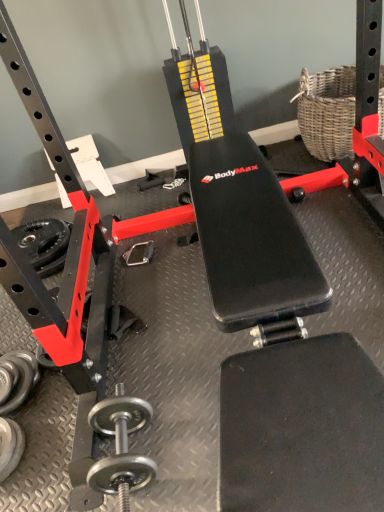
Question: Is silver metallic dumbbell at lower left, which is the third dumbbell in right-to-left order, next to woven wicker basket at upper right?

Choices:
 (A) yes
 (B) no

Answer: (B)

Question: Can you confirm if silver metallic dumbbell at lower left, marked as the first dumbbell in a left-to-right arrangement, is thinner than woven wicker basket at upper right?

Choices:
 (A) yes
 (B) no

Answer: (A)

Question: Can you confirm if silver metallic dumbbell at lower left, which is the third dumbbell in right-to-left order, is taller than woven wicker basket at upper right?

Choices:
 (A) yes
 (B) no

Answer: (B)

Question: Is silver metallic dumbbell at lower left, which is the third dumbbell in right-to-left order, far away from woven wicker basket at upper right?

Choices:
 (A) yes
 (B) no

Answer: (A)

Question: Can you confirm if silver metallic dumbbell at lower left, which is the third dumbbell in right-to-left order, is bigger than woven wicker basket at upper right?

Choices:
 (A) no
 (B) yes

Answer: (A)

Question: Could you tell me if silver metallic dumbbell at lower left, marked as the first dumbbell in a left-to-right arrangement, is facing woven wicker basket at upper right?

Choices:
 (A) no
 (B) yes

Answer: (A)

Question: Is woven wicker basket at upper right touching rubberized black weight at lower left?

Choices:
 (A) yes
 (B) no

Answer: (B)

Question: Considering the relative sizes of woven wicker basket at upper right and rubberized black weight at lower left in the image provided, is woven wicker basket at upper right smaller than rubberized black weight at lower left?

Choices:
 (A) no
 (B) yes

Answer: (A)

Question: Considering the relative sizes of woven wicker basket at upper right and rubberized black weight at lower left in the image provided, is woven wicker basket at upper right shorter than rubberized black weight at lower left?

Choices:
 (A) no
 (B) yes

Answer: (A)

Question: Is woven wicker basket at upper right further to the viewer compared to rubberized black weight at lower left?

Choices:
 (A) yes
 (B) no

Answer: (B)

Question: Considering the relative sizes of woven wicker basket at upper right and rubberized black weight at lower left in the image provided, is woven wicker basket at upper right taller than rubberized black weight at lower left?

Choices:
 (A) no
 (B) yes

Answer: (B)

Question: Does woven wicker basket at upper right turn towards rubberized black weight at lower left?

Choices:
 (A) yes
 (B) no

Answer: (B)

Question: Can you confirm if silver metallic dumbbell at lower left, which is the third dumbbell in right-to-left order, is thinner than rubberized black weight at lower left?

Choices:
 (A) yes
 (B) no

Answer: (A)